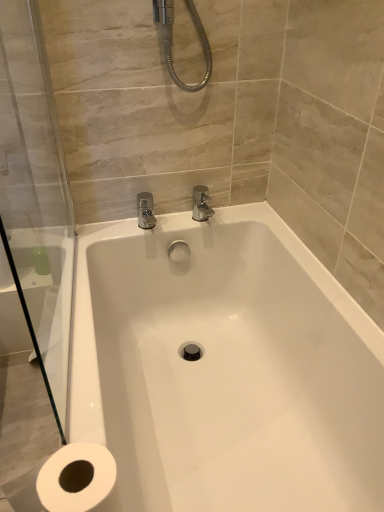
Question: Is white glossy bathtub at center not within transparent glass shower door at left?

Choices:
 (A) no
 (B) yes

Answer: (B)

Question: Are white glossy bathtub at center and transparent glass shower door at left far apart?

Choices:
 (A) no
 (B) yes

Answer: (A)

Question: Does white glossy bathtub at center come behind transparent glass shower door at left?

Choices:
 (A) no
 (B) yes

Answer: (B)

Question: Is white glossy bathtub at center taller than transparent glass shower door at left?

Choices:
 (A) yes
 (B) no

Answer: (B)

Question: Considering the relative positions of white glossy bathtub at center and transparent glass shower door at left in the image provided, is white glossy bathtub at center to the right of transparent glass shower door at left from the viewer's perspective?

Choices:
 (A) yes
 (B) no

Answer: (A)

Question: Does white glossy bathtub at center have a lesser height compared to transparent glass shower door at left?

Choices:
 (A) yes
 (B) no

Answer: (A)

Question: Does transparent glass shower door at left have a smaller size compared to white glossy bathtub at center?

Choices:
 (A) no
 (B) yes

Answer: (B)

Question: From a real-world perspective, is transparent glass shower door at left on white glossy bathtub at center?

Choices:
 (A) yes
 (B) no

Answer: (A)

Question: Would you say transparent glass shower door at left contains white glossy bathtub at center?

Choices:
 (A) no
 (B) yes

Answer: (A)

Question: Can you confirm if transparent glass shower door at left is wider than white glossy bathtub at center?

Choices:
 (A) yes
 (B) no

Answer: (B)

Question: Does transparent glass shower door at left appear on the right side of white glossy bathtub at center?

Choices:
 (A) no
 (B) yes

Answer: (A)

Question: Is transparent glass shower door at left far away from white glossy bathtub at center?

Choices:
 (A) no
 (B) yes

Answer: (A)

Question: From the image's perspective, is white glossy bathtub at center located above or below transparent glass shower door at left?

Choices:
 (A) below
 (B) above

Answer: (A)